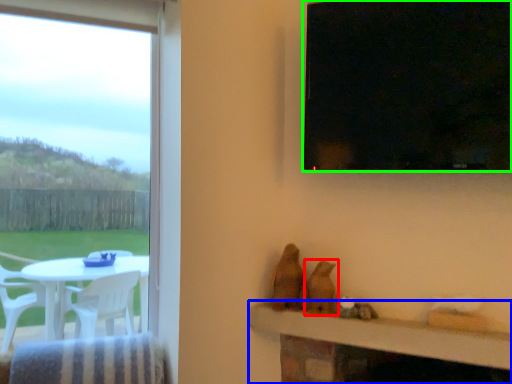
Question: Based on their relative distances, which object is nearer to animal (highlighted by a red box)? Choose from table (highlighted by a blue box) and window (highlighted by a green box).

Choices:
 (A) table
 (B) window

Answer: (A)